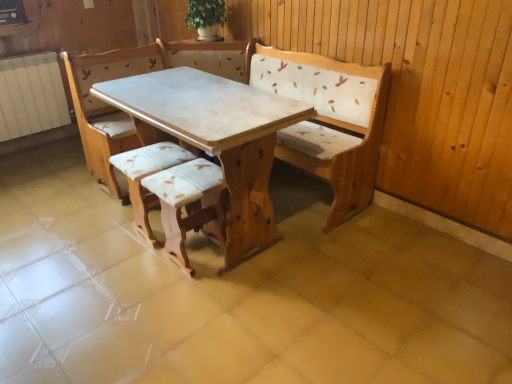
Question: Is white marble table at center outside of wooden armchair at center, which is the 2th armchair in left-to-right order?

Choices:
 (A) yes
 (B) no

Answer: (A)

Question: From the image's perspective, is white marble table at center on top of wooden armchair at center, the 1th armchair viewed from the right?

Choices:
 (A) yes
 (B) no

Answer: (A)

Question: Is white marble table at center closer to the viewer compared to wooden armchair at center, the 1th armchair viewed from the right?

Choices:
 (A) yes
 (B) no

Answer: (A)

Question: From the image's perspective, is white marble table at center beneath wooden armchair at center, the 1th armchair viewed from the right?

Choices:
 (A) yes
 (B) no

Answer: (B)

Question: From a real-world perspective, does white marble table at center sit lower than wooden armchair at center, the 1th armchair viewed from the right?

Choices:
 (A) yes
 (B) no

Answer: (B)

Question: From a real-world perspective, is matte white cushioned stool at center, which is the first armchair in left-to-right order, positioned above or below wooden armchair at center, the 1th armchair viewed from the right?

Choices:
 (A) below
 (B) above

Answer: (A)

Question: From the image's perspective, is matte white cushioned stool at center, which is the second armchair in right-to-left order, above or below wooden armchair at center, which is the 2th armchair in left-to-right order?

Choices:
 (A) above
 (B) below

Answer: (A)

Question: In the image, is matte white cushioned stool at center, which is the first armchair in left-to-right order, positioned in front of or behind wooden armchair at center, which is the 2th armchair in left-to-right order?

Choices:
 (A) behind
 (B) front

Answer: (A)

Question: Based on their sizes in the image, would you say matte white cushioned stool at center, which is the first armchair in left-to-right order, is bigger or smaller than wooden armchair at center, the 1th armchair viewed from the right?

Choices:
 (A) big
 (B) small

Answer: (B)

Question: Is white marble table at center situated inside white painted metal radiator at left or outside?

Choices:
 (A) outside
 (B) inside

Answer: (A)

Question: In terms of height, does white marble table at center look taller or shorter compared to white painted metal radiator at left?

Choices:
 (A) tall
 (B) short

Answer: (A)

Question: From a real-world perspective, is white marble table at center physically located above or below white painted metal radiator at left?

Choices:
 (A) below
 (B) above

Answer: (A)

Question: From the image's perspective, is white marble table at center positioned above or below white painted metal radiator at left?

Choices:
 (A) below
 (B) above

Answer: (A)

Question: Is point (5, 97) closer or farther from the camera than point (256, 92)?

Choices:
 (A) farther
 (B) closer

Answer: (A)

Question: Would you say white painted metal radiator at left is to the left or to the right of white marble table at center in the picture?

Choices:
 (A) right
 (B) left

Answer: (B)